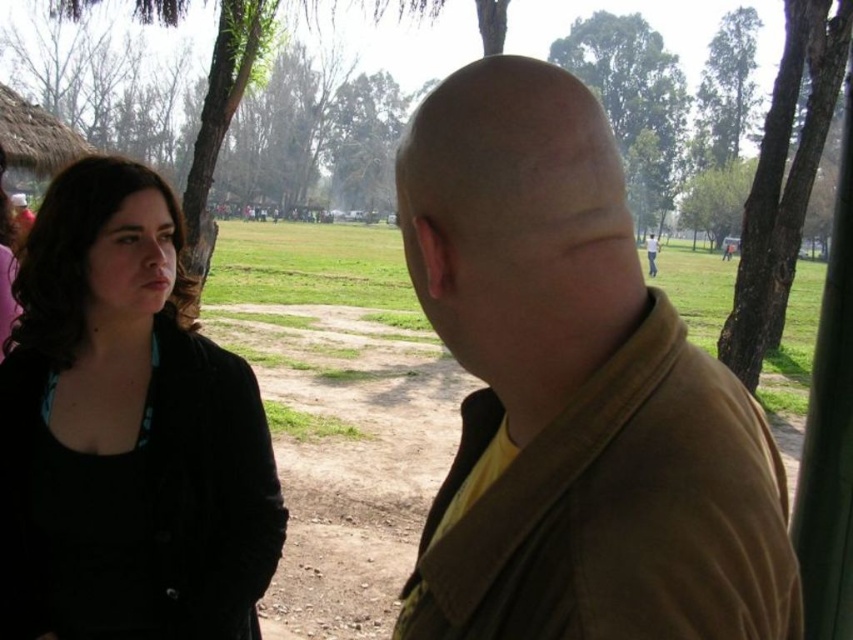
Question: Is brown matte jacket at center smaller than black matte jacket at left?

Choices:
 (A) no
 (B) yes

Answer: (B)

Question: Is brown matte jacket at center wider than black matte jacket at left?

Choices:
 (A) no
 (B) yes

Answer: (A)

Question: Is brown matte jacket at center to the left of black matte jacket at left from the viewer's perspective?

Choices:
 (A) yes
 (B) no

Answer: (B)

Question: Which point appears closest to the camera in this image?

Choices:
 (A) (540, 80)
 (B) (161, 404)

Answer: (A)

Question: Which point is closer to the camera?

Choices:
 (A) brown matte jacket at center
 (B) black matte jacket at left

Answer: (A)